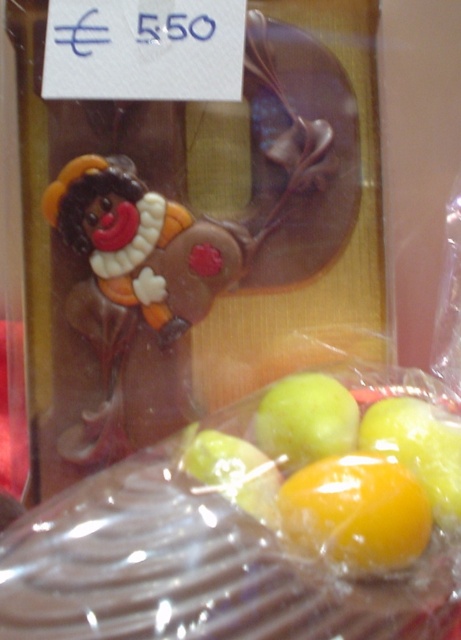
Question: Can you confirm if yellow shiny fruit at lower center is thinner than green matte apple at center?

Choices:
 (A) no
 (B) yes

Answer: (A)

Question: Does yellow shiny fruit at lower center appear over green matte apple at center?

Choices:
 (A) yes
 (B) no

Answer: (B)

Question: Can you confirm if yellow shiny fruit at lower center is positioned to the left of green matte apple at center?

Choices:
 (A) yes
 (B) no

Answer: (B)

Question: Which object appears closest to the camera in this image?

Choices:
 (A) green matte apple at center
 (B) yellow shiny fruit at lower center

Answer: (B)